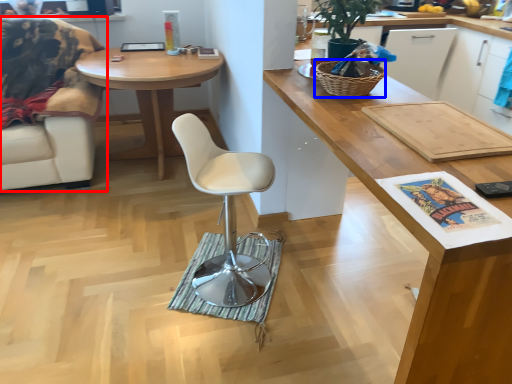
Question: Which of the following is the closest to the observer, chair (highlighted by a red box) or picnic basket (highlighted by a blue box)?

Choices:
 (A) chair
 (B) picnic basket

Answer: (B)